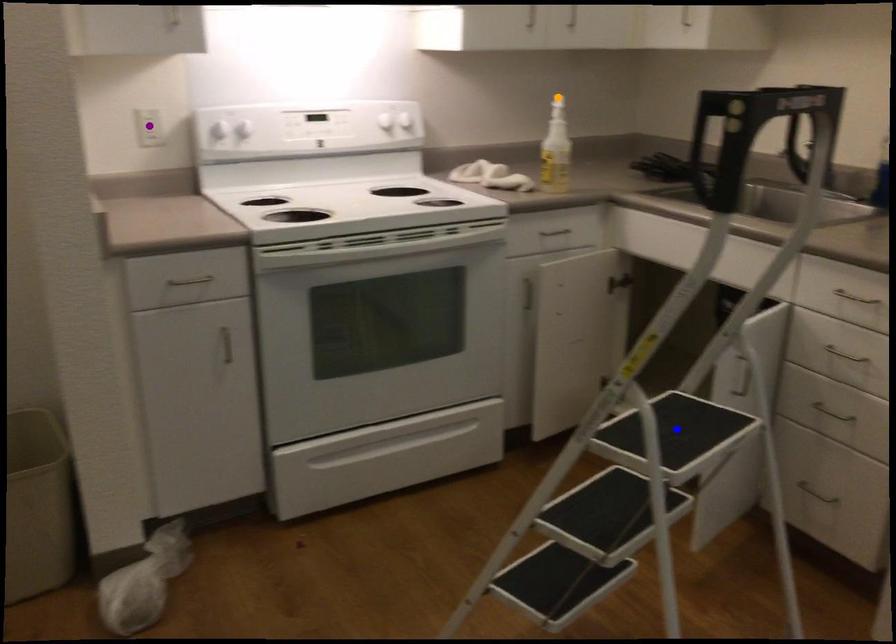
Order these from nearest to farthest:
orange point
blue point
purple point

1. blue point
2. purple point
3. orange point